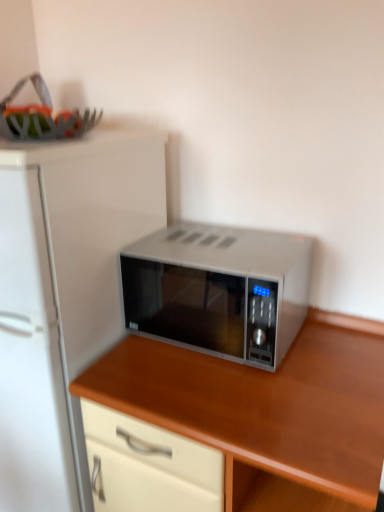
Question: Considering the relative positions of white matte refrigerator at left and satin silver microwave at center in the image provided, is white matte refrigerator at left to the left or to the right of satin silver microwave at center?

Choices:
 (A) right
 (B) left

Answer: (B)

Question: Based on their sizes in the image, would you say white matte refrigerator at left is bigger or smaller than satin silver microwave at center?

Choices:
 (A) small
 (B) big

Answer: (B)

Question: Which is nearer to the satin silver microwave at center?

Choices:
 (A) white matte refrigerator at left
 (B) satin silver microwave at center

Answer: (B)

Question: Which is nearer to the white matte refrigerator at left?

Choices:
 (A) satin silver microwave at center
 (B) satin silver microwave at center

Answer: (B)